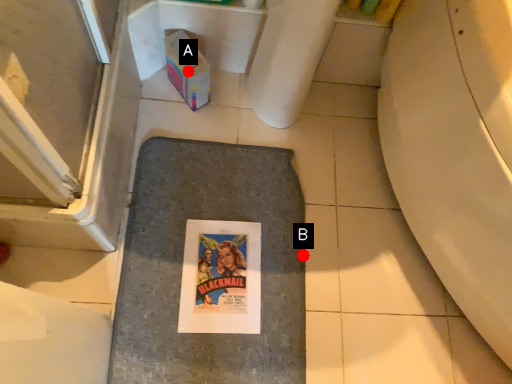
Question: Two points are circled on the image, labeled by A and B beside each circle. Among these points, which one is nearest to the camera?

Choices:
 (A) A is closer
 (B) B is closer

Answer: (A)